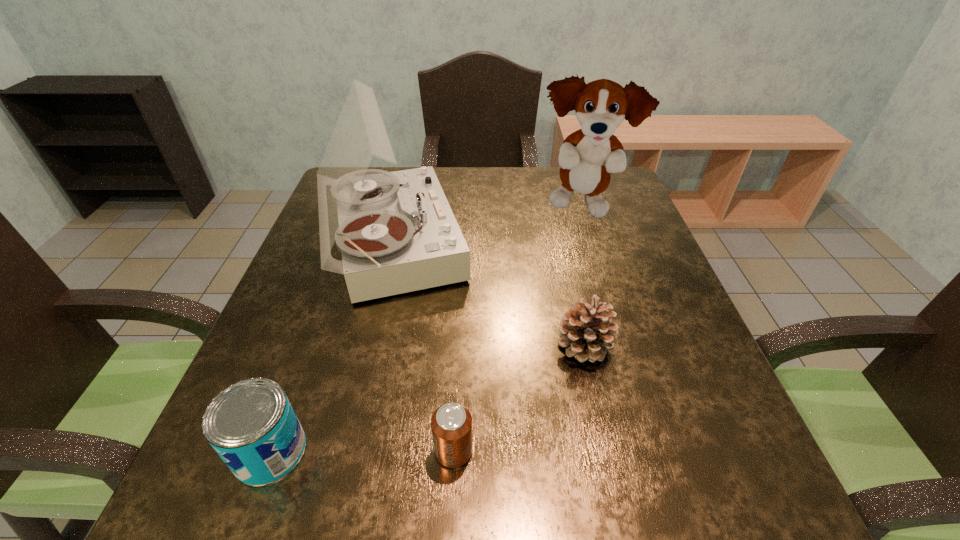
At what (x,y) coordinates should I click in order to perform the action: click on vacant space at the near edge of the desktop. Please return your answer as a coordinate pair (x, y). Looking at the image, I should click on (351, 480).

This screenshot has height=540, width=960. Identify the location of vacant space at the left edge of the desktop. (286, 338).

The image size is (960, 540). In the image, there is a desktop. In order to click on vacant space at the right edge in this screenshot , I will do `click(638, 251)`.

Identify the location of vacant area at the near left corner of the desktop. This screenshot has width=960, height=540. (185, 523).

You are a GUI agent. You are given a task and a screenshot of the screen. Output one action in this format:
    pyautogui.click(x=<x>, y=<y>)
    Task: Click on the vacant area that lies between the third nearest object and the right can
    
    Given the screenshot: What is the action you would take?
    (519, 398)

You are a GUI agent. You are given a task and a screenshot of the screen. Output one action in this format:
    pyautogui.click(x=<x>, y=<y>)
    Task: Click on the free spot between the puppy and the record player
    This screenshot has height=540, width=960.
    Given the screenshot: What is the action you would take?
    pyautogui.click(x=486, y=226)

This screenshot has height=540, width=960. What are the coordinates of `free space that is in between the pinecone and the puppy` in the screenshot? It's located at (583, 276).

Locate an element on the screen. This screenshot has height=540, width=960. free space that is in between the right can and the left can is located at coordinates (362, 451).

Locate an element on the screen. blank region between the record player and the left can is located at coordinates (331, 347).

The width and height of the screenshot is (960, 540). What are the coordinates of `free space between the puppy and the third farthest object` in the screenshot? It's located at (583, 276).